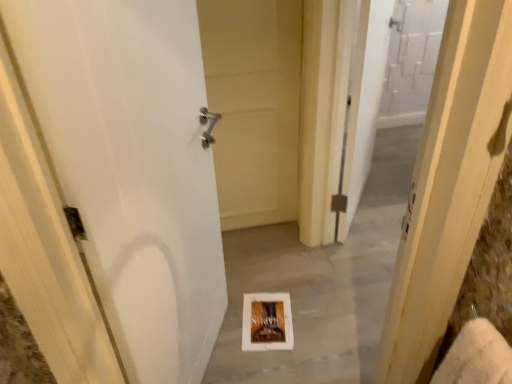
Question: Is white matte door at center, the 1th door in the front-to-back sequence, aimed at white cardboard book at center?

Choices:
 (A) yes
 (B) no

Answer: (A)

Question: Is white matte door at center, the second door from the back, positioned in front of white cardboard book at center?

Choices:
 (A) no
 (B) yes

Answer: (B)

Question: From a real-world perspective, is white matte door at center, the second door from the back, positioned over white cardboard book at center based on gravity?

Choices:
 (A) no
 (B) yes

Answer: (B)

Question: Is white matte door at center, the 1th door in the front-to-back sequence, positioned far away from white cardboard book at center?

Choices:
 (A) no
 (B) yes

Answer: (A)

Question: Is white matte door at center, the 1th door in the front-to-back sequence, located outside white cardboard book at center?

Choices:
 (A) no
 (B) yes

Answer: (B)

Question: Is point (204, 375) closer or farther from the camera than point (157, 256)?

Choices:
 (A) closer
 (B) farther

Answer: (B)

Question: Looking at the image, does white paper at center seem bigger or smaller compared to white matte door at center, the second door from the back?

Choices:
 (A) big
 (B) small

Answer: (B)

Question: From their relative heights in the image, would you say white paper at center is taller or shorter than white matte door at center, the 1th door in the front-to-back sequence?

Choices:
 (A) short
 (B) tall

Answer: (A)

Question: Considering their positions, is white paper at center located in front of or behind white matte door at center, the 1th door in the front-to-back sequence?

Choices:
 (A) behind
 (B) front

Answer: (A)

Question: Relative to white matte door at center, the second door from the back, is white cardboard book at center in front or behind?

Choices:
 (A) behind
 (B) front

Answer: (A)

Question: Is point (288, 347) closer or farther from the camera than point (143, 352)?

Choices:
 (A) farther
 (B) closer

Answer: (A)

Question: Considering the relative positions of white cardboard book at center and white matte door at center, the 1th door in the front-to-back sequence, in the image provided, is white cardboard book at center to the left or to the right of white matte door at center, the 1th door in the front-to-back sequence,?

Choices:
 (A) left
 (B) right

Answer: (B)

Question: From the image's perspective, relative to white matte door at center, the second door from the back, is white cardboard book at center above or below?

Choices:
 (A) above
 (B) below

Answer: (B)

Question: Based on their positions, is white matte door at center, the second door from the back, located to the left or right of white paper at center?

Choices:
 (A) right
 (B) left

Answer: (B)

Question: Considering the positions of point (100, 157) and point (250, 374), is point (100, 157) closer or farther from the camera than point (250, 374)?

Choices:
 (A) closer
 (B) farther

Answer: (A)